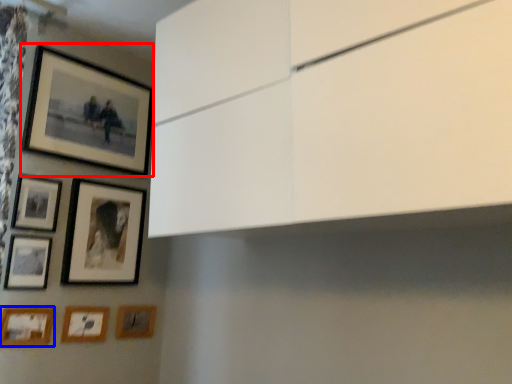
Question: Which object is further to the camera taking this photo, picture frame (highlighted by a red box) or picture frame (highlighted by a blue box)?

Choices:
 (A) picture frame
 (B) picture frame

Answer: (A)